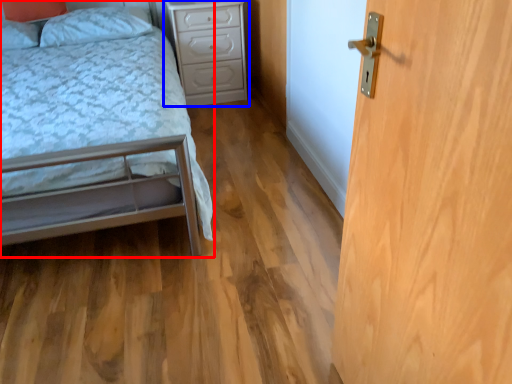
Question: Which of the following is the farthest to the observer, bed (highlighted by a red box) or nightstand (highlighted by a blue box)?

Choices:
 (A) bed
 (B) nightstand

Answer: (B)